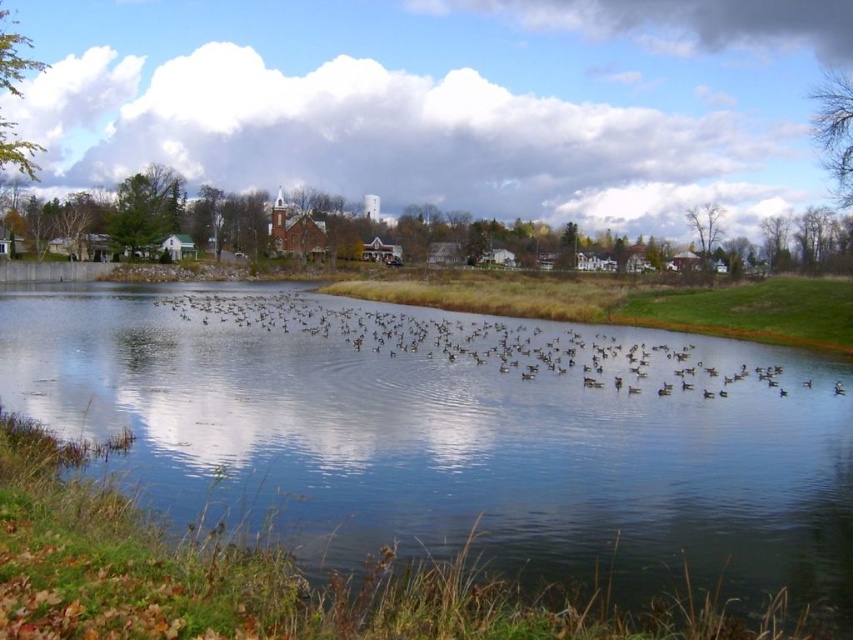
You are standing at the lakeside and want to take a photo of the clear water at center and the brown matte birds at center. Which object should you focus on first to ensure both are in focus?

You should focus on the brown matte birds at center first because they are farther away from the viewer compared to the clear water at center, allowing both to be in focus when using depth of field techniques.

You are standing at the edge of the lake and want to locate the clear water at center. According to the coordinates provided, where exactly would you find it?

The clear water at center is located at coordinates point (457, 440).

You are an observer standing at the lakeside. You notice the clear water at center and the brown matte birds at center. Which object is positioned higher in the image?

The brown matte birds at center are higher in the image than the clear water at center because the clear water at center is not as tall as the brown matte birds at center.